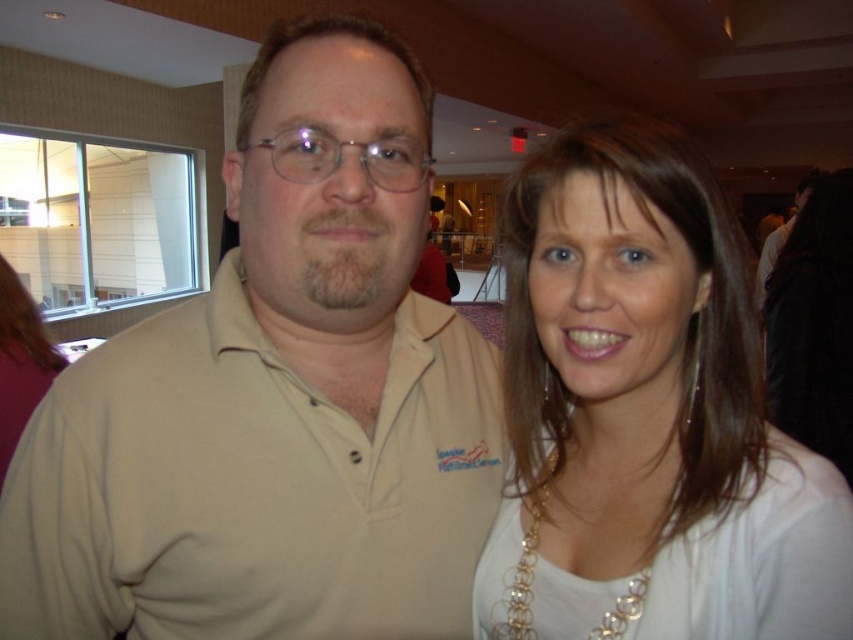
You are organizing a photo shoot and need to ensure that the beige cotton polo shirt at center and the white fabric at upper right fit within a rectangular frame. Based on their widths, can both items be placed side by side without overlapping?

The beige cotton polo shirt at center might be wider than white fabric at upper right, so there is a possibility that placing them side by side could result in overlapping if the total width exceeds the frame size. However, without exact measurements, it is uncertain. Consider checking the exact dimensions to ensure proper placement.

You are a photographer at a networking event and need to capture a photo of both the beige cotton polo shirt at center and the white fabric at upper right in the same frame. Given that your camera has a minimum focus distance of 6 inches, will you be able to achieve this shot?

The beige cotton polo shirt at center and white fabric at upper right are 6.76 inches apart. Since the distance between them is greater than the camera minimum focus distance of 6 inches, you can capture both in the same frame.

You are at a networking event and want to approach the person wearing the beige cotton polo shirt at center and the white fabric at upper right. Which one should you walk towards first if you want to greet them in the order from closest to farthest?

You should first walk towards the beige cotton polo shirt at center because it is closer to you than the white fabric at upper right.